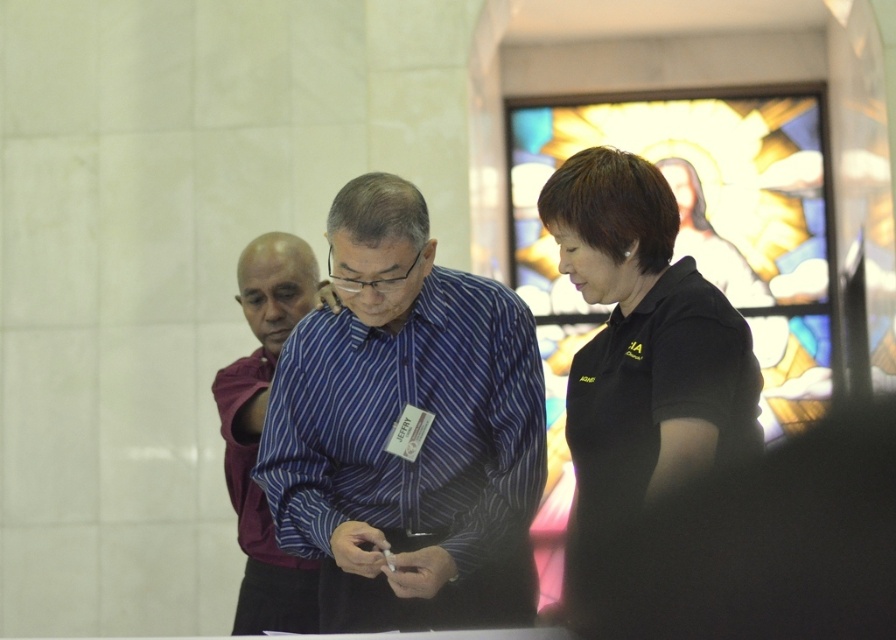
You are a person standing at the blue striped shirt at center. You want to hand a document to the stained glass at upper right. Can you reach it without moving from your current position?

The blue striped shirt at center and stained glass at upper right are 6.32 meters apart from each other, so you cannot reach the stained glass at upper right without moving from your current position.

You are standing in the room and want to reach the stained glass at upper right and the black matte shirt at center. Which object is closer to you?

The stained glass at upper right is closer to the viewer than the black matte shirt at center.

You are standing in a conference room and see the blue striped shirt at center and the stained glass at upper right. Which object is higher up in the image?

The stained glass at upper right is higher up in the image than the blue striped shirt at center.